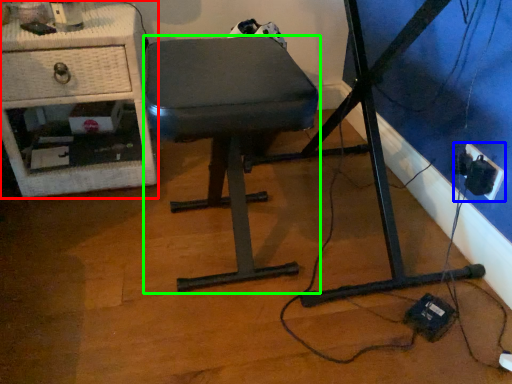
Question: Considering the real-world distances, which object is closest to furniture (highlighted by a red box)? electric outlet (highlighted by a blue box) or stool (highlighted by a green box).

Choices:
 (A) electric outlet
 (B) stool

Answer: (B)